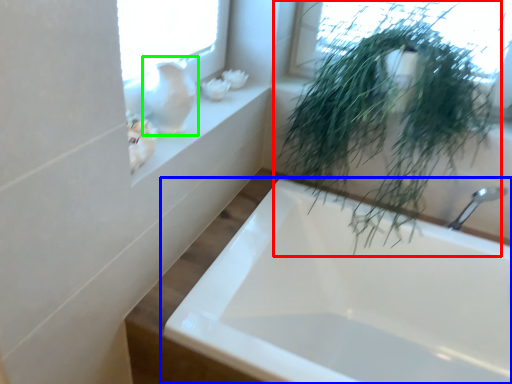
Question: Which object is the closest to the houseplant (highlighted by a red box)? Choose among these: bathtub (highlighted by a blue box) or glass vase (highlighted by a green box).

Choices:
 (A) bathtub
 (B) glass vase

Answer: (A)